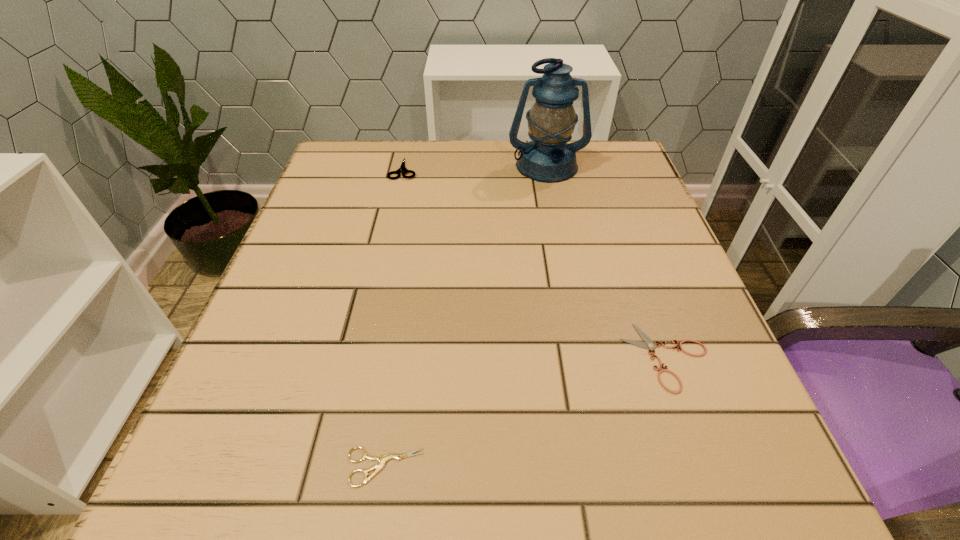
Locate an element on the screen. The image size is (960, 540). the tallest object is located at coordinates (548, 158).

You are a GUI agent. You are given a task and a screenshot of the screen. Output one action in this format:
    pyautogui.click(x=<x>, y=<y>)
    Task: Click on the third shortest object
    
    Given the screenshot: What is the action you would take?
    pyautogui.click(x=402, y=168)

Locate an element on the screen. the farthest shears is located at coordinates (402, 168).

Locate an element on the screen. the nearest object is located at coordinates [x=382, y=459].

Find the location of a particular element. This screenshot has width=960, height=540. the rightmost shears is located at coordinates (648, 343).

At what (x,y) coordinates should I click in order to perform the action: click on the second nearest shears. Please return your answer as a coordinate pair (x, y). Looking at the image, I should click on 648,343.

Identify the location of vacant space positioned on the face of the tallest object. (562, 239).

This screenshot has width=960, height=540. In order to click on vacant space positioned on the front of the farthest shears in this screenshot , I will do `click(385, 248)`.

Where is `vacant space positioned 0.260m on the right of the nearest shears`? Image resolution: width=960 pixels, height=540 pixels. vacant space positioned 0.260m on the right of the nearest shears is located at coordinates (628, 467).

At what (x,y) coordinates should I click in order to perform the action: click on free spot located 0.090m on the front of the second nearest object. Please return your answer as a coordinate pair (x, y). The image size is (960, 540). Looking at the image, I should click on click(x=702, y=456).